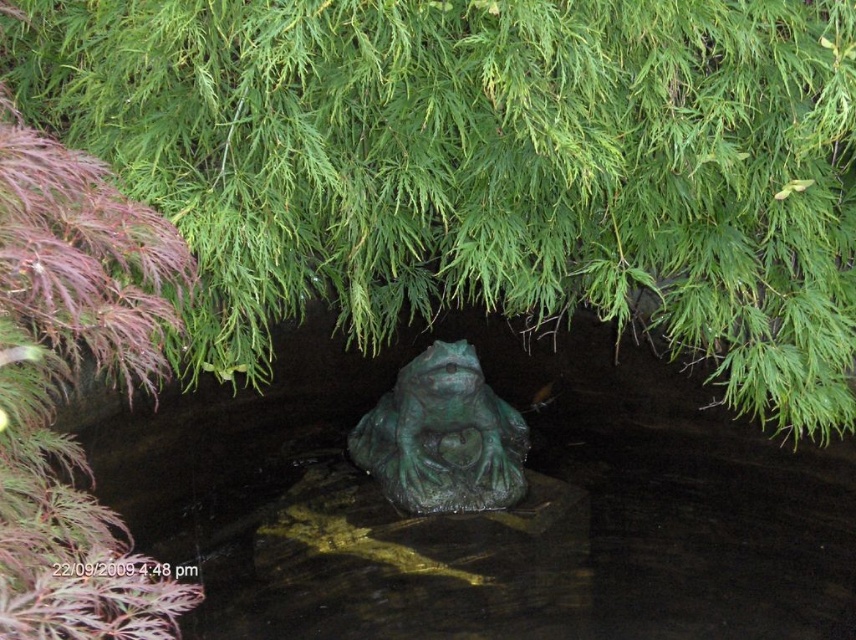
Question: Which point is closer to the camera?

Choices:
 (A) green matte tree at center
 (B) purple leafy plant at left
 (C) green patina stone frog at center

Answer: (B)

Question: Is green matte tree at center closer to the viewer compared to green patina stone frog at center?

Choices:
 (A) no
 (B) yes

Answer: (B)

Question: Can you confirm if purple leafy plant at left is thinner than green patina stone frog at center?

Choices:
 (A) no
 (B) yes

Answer: (B)

Question: Does green matte tree at center have a smaller size compared to green patina stone frog at center?

Choices:
 (A) no
 (B) yes

Answer: (A)

Question: Which of the following is the closest to the observer?

Choices:
 (A) (412, 128)
 (B) (159, 589)

Answer: (B)

Question: Which point appears farthest from the camera in this image?

Choices:
 (A) (126, 570)
 (B) (390, 307)

Answer: (B)